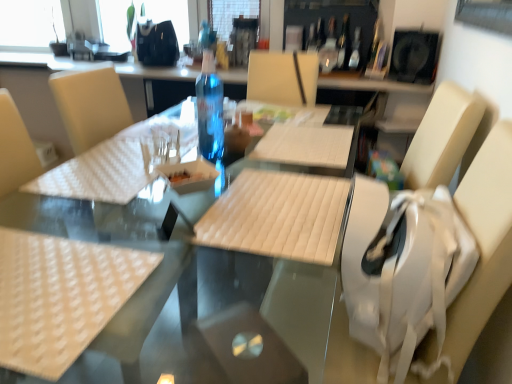
Question: Can you confirm if transparent plastic bottle at center, positioned as the 2th bottle in left-to-right order, is wider than white fabric swivel chair at right?

Choices:
 (A) no
 (B) yes

Answer: (A)

Question: Does transparent plastic bottle at center, which is counted as the first bottle, starting from the top, have a lesser width compared to white fabric swivel chair at right?

Choices:
 (A) no
 (B) yes

Answer: (B)

Question: Is there a large distance between transparent plastic bottle at center, marked as the third bottle in a bottom-to-top arrangement, and white fabric swivel chair at right?

Choices:
 (A) no
 (B) yes

Answer: (B)

Question: From the image's perspective, is transparent plastic bottle at center, positioned as the 2th bottle in left-to-right order, on white fabric swivel chair at right?

Choices:
 (A) no
 (B) yes

Answer: (B)

Question: From a real-world perspective, is transparent plastic bottle at center, marked as the third bottle in a bottom-to-top arrangement, physically below white fabric swivel chair at right?

Choices:
 (A) yes
 (B) no

Answer: (B)

Question: From a real-world perspective, relative to transparent plastic bottle at center, which appears as the third bottle when viewed from the back, is transparent plastic bottle at center, placed as the third bottle when sorted from front to back, vertically above or below?

Choices:
 (A) above
 (B) below

Answer: (A)

Question: In the image, is transparent plastic bottle at center, positioned as the 2th bottle in left-to-right order, on the left side or the right side of transparent plastic bottle at center, which is the third bottle from top to bottom?

Choices:
 (A) left
 (B) right

Answer: (B)

Question: Is transparent plastic bottle at center, the 1th bottle positioned from the back, situated inside transparent plastic bottle at center, which appears as the third bottle when viewed from the back, or outside?

Choices:
 (A) inside
 (B) outside

Answer: (B)

Question: Considering the positions of transparent plastic bottle at center, which is counted as the first bottle, starting from the top, and transparent plastic bottle at center, which is the third bottle from top to bottom, in the image, is transparent plastic bottle at center, which is counted as the first bottle, starting from the top, wider or thinner than transparent plastic bottle at center, which is the third bottle from top to bottom,?

Choices:
 (A) wide
 (B) thin

Answer: (A)

Question: From a real-world perspective, relative to translucent glass wine bottle at upper center, is white quilted placemat at center vertically above or below?

Choices:
 (A) above
 (B) below

Answer: (B)

Question: In the image, is white quilted placemat at center on the left side or the right side of translucent glass wine bottle at upper center?

Choices:
 (A) right
 (B) left

Answer: (B)

Question: Is white quilted placemat at center taller or shorter than translucent glass wine bottle at upper center?

Choices:
 (A) tall
 (B) short

Answer: (A)

Question: From the image's perspective, is white quilted placemat at center located above or below translucent glass wine bottle at upper center?

Choices:
 (A) below
 (B) above

Answer: (A)

Question: Which is correct: transparent plastic bottle at center, which appears as the third bottle when viewed from the back, is inside transparent glass window at upper left, or outside of it?

Choices:
 (A) outside
 (B) inside

Answer: (A)

Question: Considering the positions of transparent plastic bottle at center, the first bottle in the left-to-right sequence, and transparent glass window at upper left in the image, is transparent plastic bottle at center, the first bottle in the left-to-right sequence, bigger or smaller than transparent glass window at upper left?

Choices:
 (A) small
 (B) big

Answer: (A)